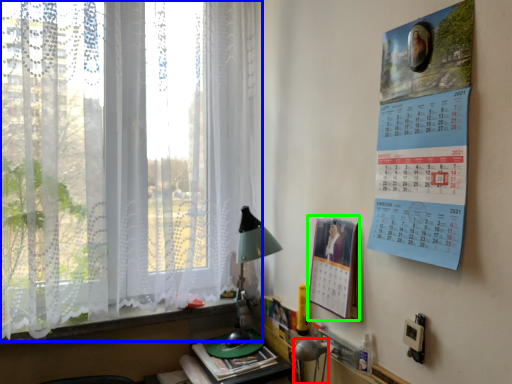
Question: Based on their relative distances, which object is nearer to table lamp (highlighted by a red box)? Choose from window (highlighted by a blue box) and poster page (highlighted by a green box).

Choices:
 (A) window
 (B) poster page

Answer: (B)